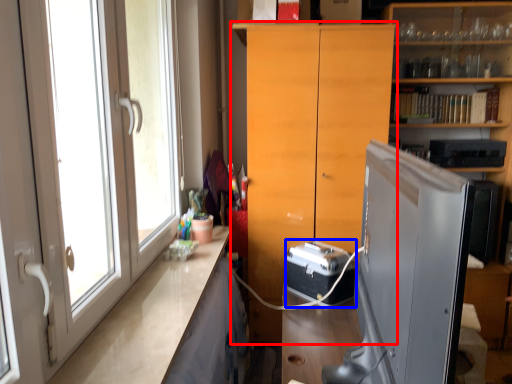
Question: Which object is further to the camera taking this photo, cabinetry (highlighted by a red box) or appliance (highlighted by a blue box)?

Choices:
 (A) cabinetry
 (B) appliance

Answer: (A)